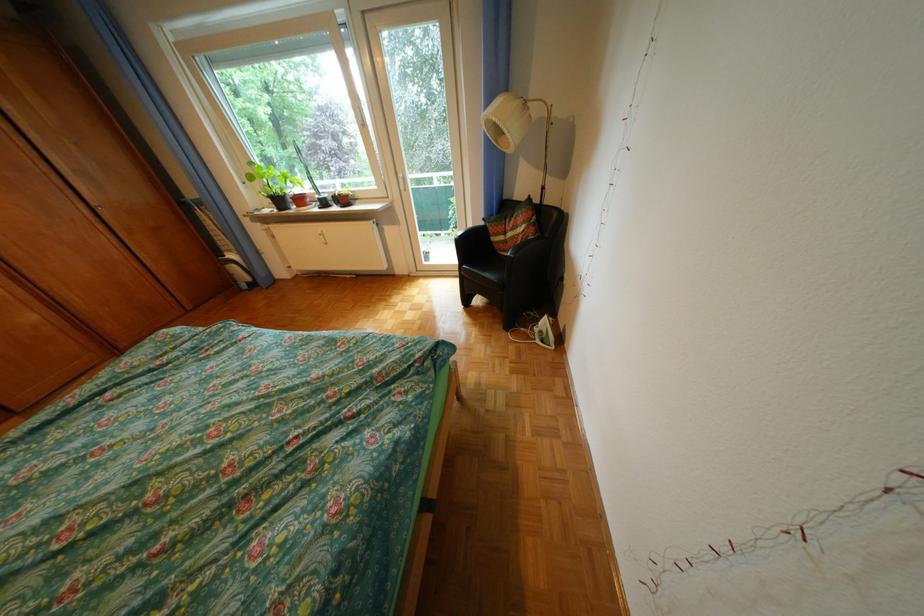
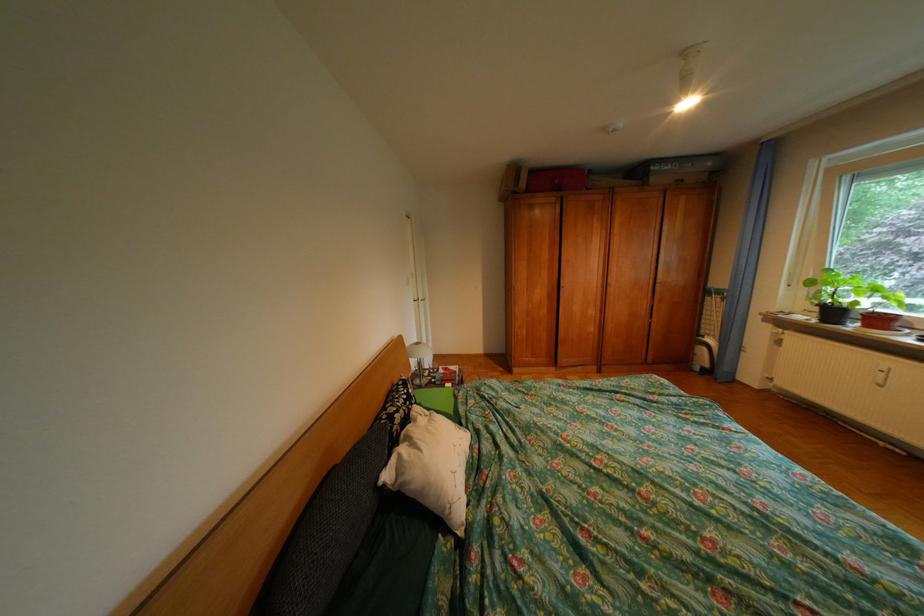
Question: Based on the continuous images, in which direction is the camera rotating? Reply with the corresponding letter.

Choices:
 (A) Left
 (B) Right
 (C) Up
 (D) Down

Answer: (A)